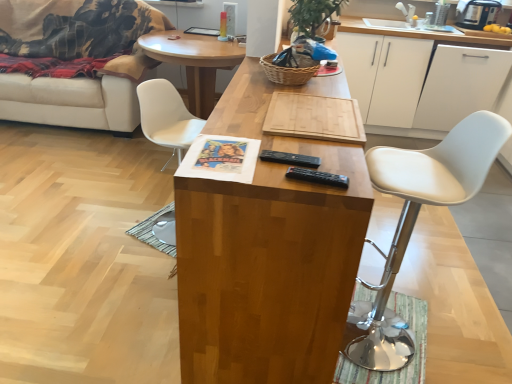
Question: Would you say white leather stool at right, the first chair from the front, is to the left or to the right of white matte cabinet at upper right, which appears as the second cabinetry when viewed from the left, in the picture?

Choices:
 (A) left
 (B) right

Answer: (A)

Question: Based on their sizes in the image, would you say white leather stool at right, the 2th chair in the back-to-front sequence, is bigger or smaller than white matte cabinet at upper right, which appears as the second cabinetry when viewed from the left?

Choices:
 (A) small
 (B) big

Answer: (A)

Question: Estimate the real-world distances between objects in this image. Which object is closer to the white plastic chair at center, which appears as the 2th chair when viewed from the front?

Choices:
 (A) wooden cutting board at center, acting as the first coffee table starting from the back
 (B) white matte cabinet at upper right, the first cabinetry positioned from the left
 (C) white leather stool at right, acting as the second chair starting from the left
 (D) wooden cutting board at center, positioned as the second coffee table in back-to-front order
 (E) white fabric couch at left

Answer: (D)

Question: Estimate the real-world distances between objects in this image. Which object is farther from the wooden cutting board at center, which appears as the 2th coffee table when viewed from the front?

Choices:
 (A) wooden cutting board at center, which is the 1th coffee table in front-to-back order
 (B) woven brown basket at center
 (C) white leather stool at right, which appears as the first chair when viewed from the right
 (D) white fabric couch at left
 (E) white matte cabinet at upper right, which appears as the second cabinetry when viewed from the left

Answer: (C)